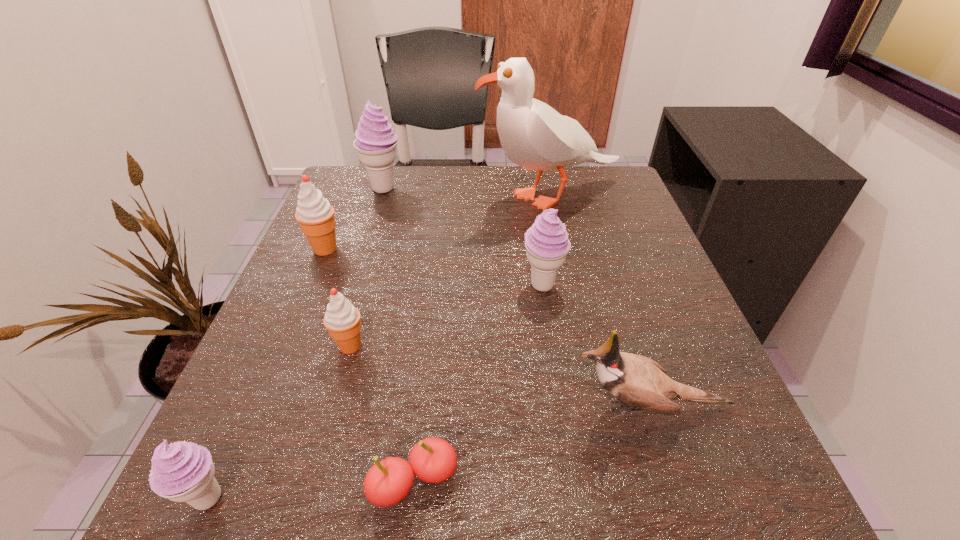
This screenshot has height=540, width=960. I want to click on gull, so click(533, 135).

Where is `the tallest icecream`? the tallest icecream is located at coordinates (376, 142).

This screenshot has width=960, height=540. In order to click on the biggest purple icecream in this screenshot , I will do `click(376, 142)`.

The image size is (960, 540). Identify the location of the second farthest icecream. (315, 215).

The width and height of the screenshot is (960, 540). Find the location of `the left red icecream`. the left red icecream is located at coordinates (315, 215).

Where is `the rightmost icecream`? This screenshot has height=540, width=960. the rightmost icecream is located at coordinates (546, 242).

This screenshot has height=540, width=960. I want to click on the rightmost purple icecream, so pyautogui.click(x=546, y=242).

I want to click on bird, so click(640, 382).

Locate an element on the screen. the fourth farthest icecream is located at coordinates (342, 319).

Where is `the fourth nearest object`? This screenshot has height=540, width=960. the fourth nearest object is located at coordinates (342, 319).